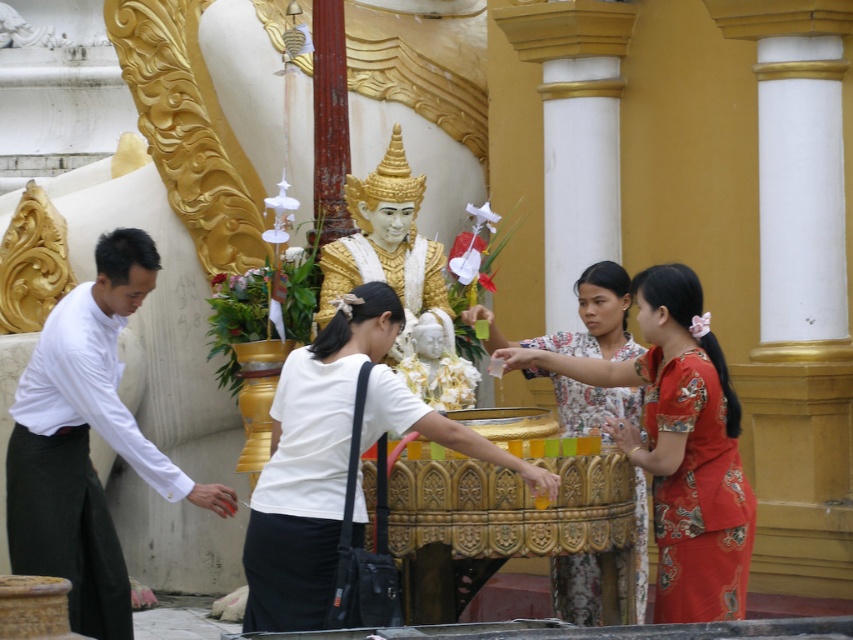
You are a photographer taking a picture of the temple scene. You notice the white matte shirt at left and the gold plated statue at center. Which object should you focus on to ensure it appears larger in your photo?

The white matte shirt at left should be focused on to appear larger because it is taller than the gold plated statue at center.